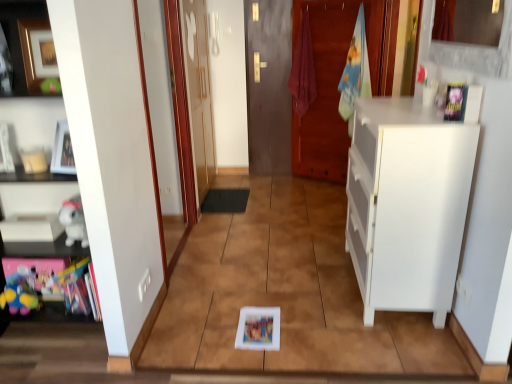
The height and width of the screenshot is (384, 512). In order to click on empty space that is ontop of black rubber mat at center (from a real-world perspective) in this screenshot , I will do `click(231, 196)`.